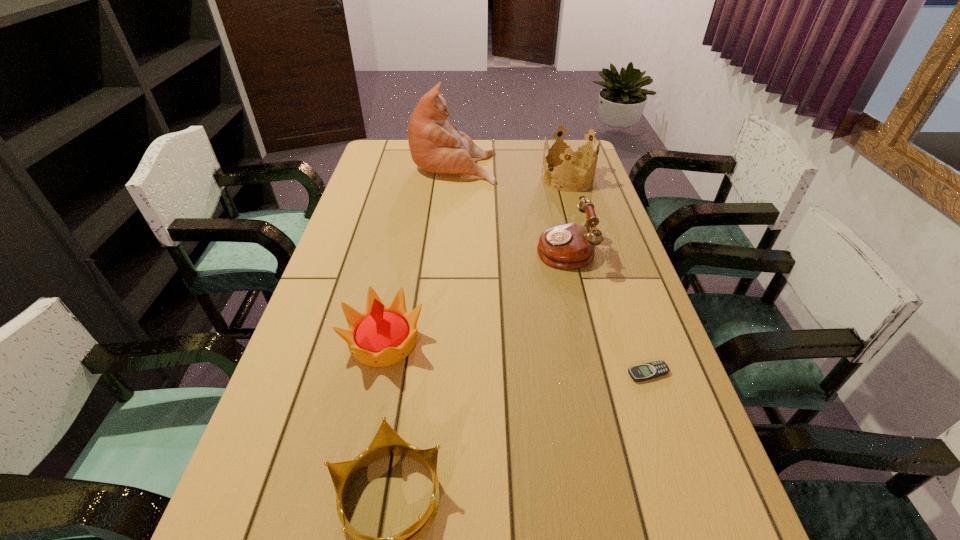
Where is `vacant region at the left edge of the desktop`? The width and height of the screenshot is (960, 540). vacant region at the left edge of the desktop is located at coordinates (375, 194).

The width and height of the screenshot is (960, 540). In order to click on vacant space at the right edge in this screenshot , I will do `click(570, 211)`.

I want to click on free space at the far left corner of the desktop, so click(x=373, y=151).

This screenshot has height=540, width=960. In order to click on empty location between the second nearest crown and the shortest object in this screenshot , I will do pos(516,357).

At what (x,y) coordinates should I click in order to perform the action: click on free space between the rightmost crown and the second farthest crown. Please return your answer as a coordinate pair (x, y). Looking at the image, I should click on (475, 260).

Identify which object is located as the fourth nearest to the fourth nearest object. Please provide its 2D coordinates. Your answer should be formatted as a tuple, i.e. [(x, y)], where the tuple contains the x and y coordinates of a point satisfying the conditions above.

[(381, 336)]

Where is `object that stands as the fourth closest to the second farthest crown`? The width and height of the screenshot is (960, 540). object that stands as the fourth closest to the second farthest crown is located at coordinates [x=436, y=145].

This screenshot has width=960, height=540. In order to click on crown that is the third closest one to the beeper in this screenshot , I will do `click(571, 152)`.

The width and height of the screenshot is (960, 540). What are the coordinates of `crown that stands as the closest to the tallest object` in the screenshot? It's located at (571, 152).

Locate an element on the screen. vacant space that satisfies the following two spatial constraints: 1. on the back side of the shortest object; 2. on the dial of the third farthest object is located at coordinates (606, 248).